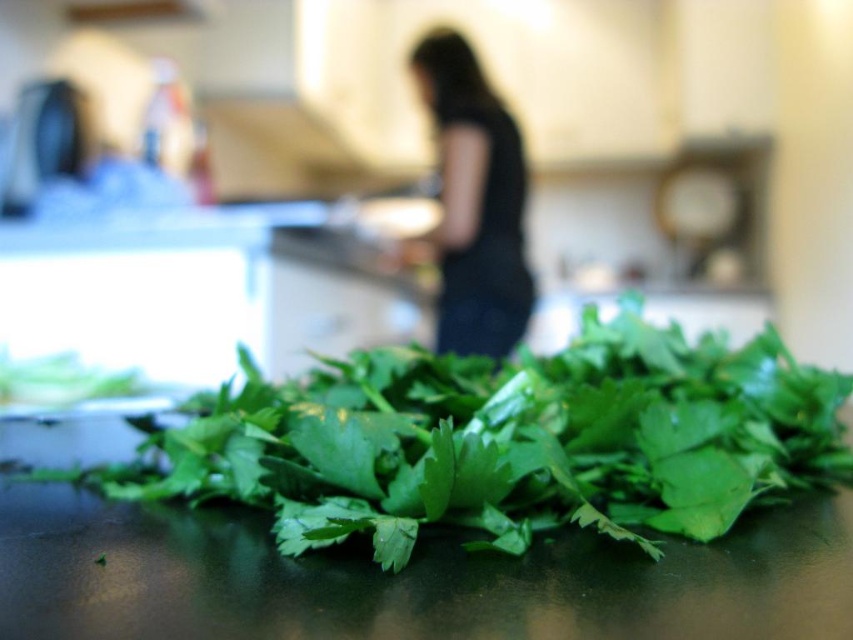
Can you confirm if green leafy at center is positioned to the left of black fabric at center?

Yes, green leafy at center is to the left of black fabric at center.

Is point (407, 349) farther from camera compared to point (469, 76)?

No, (407, 349) is closer to viewer.

Describe the element at coordinates (502, 440) in the screenshot. I see `green leafy at center` at that location.

Where is `green leafy at center`? The height and width of the screenshot is (640, 853). green leafy at center is located at coordinates (502, 440).